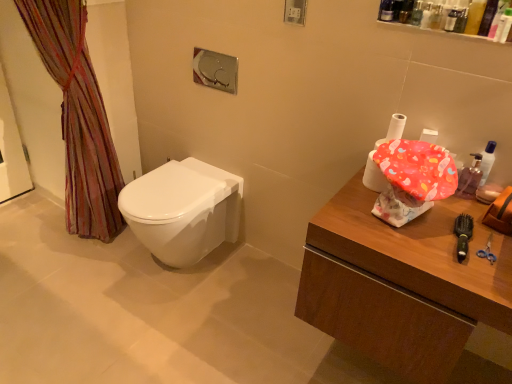
Find the location of a particular element. free region under multicolored fabric curtain at left (from a real-world perspective) is located at coordinates coord(79,248).